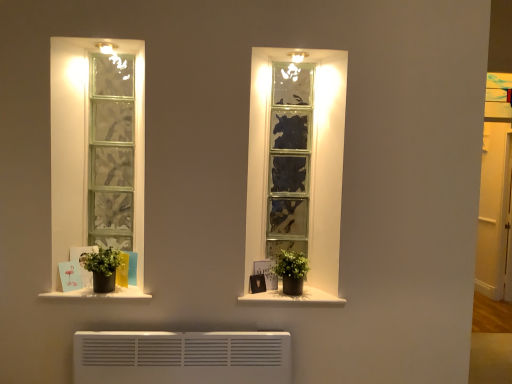
What is the approximate width of green matte pot at left, which is the first houseplant in left-to-right order?

green matte pot at left, which is the first houseplant in left-to-right order, is 6.57 inches wide.

What do you see at coordinates (495, 214) in the screenshot?
I see `transparent glass door at right` at bounding box center [495, 214].

What is the approximate width of white matte window sill at center, acting as the 2th window sill starting from the left?

white matte window sill at center, acting as the 2th window sill starting from the left, is 10.21 inches wide.

The width and height of the screenshot is (512, 384). What are the coordinates of `green matte plant at right, which is the first houseplant from right to left` in the screenshot? It's located at (291, 271).

Is green matte plant at right, which appears as the second houseplant when viewed from the left, with matte black picture frame at center?

green matte plant at right, which appears as the second houseplant when viewed from the left, and matte black picture frame at center are not in contact.

Would you say green matte plant at right, which is the first houseplant from right to left, is outside matte black picture frame at center?

Absolutely, green matte plant at right, which is the first houseplant from right to left, is external to matte black picture frame at center.

What's the angular difference between green matte plant at right, which is the first houseplant from right to left, and matte black picture frame at center's facing directions?

There is a 31.3-degree angle between the facing directions of green matte plant at right, which is the first houseplant from right to left, and matte black picture frame at center.

From a real-world perspective, which is physically above, green matte plant at right, which appears as the second houseplant when viewed from the left, or matte black picture frame at center?

green matte plant at right, which appears as the second houseplant when viewed from the left.

Measure the distance from transparent glass door at right to green matte plant at right, which appears as the second houseplant when viewed from the left.

A distance of 3.14 meters exists between transparent glass door at right and green matte plant at right, which appears as the second houseplant when viewed from the left.

Is transparent glass door at right beside green matte plant at right, which appears as the second houseplant when viewed from the left?

No, transparent glass door at right is not touching green matte plant at right, which appears as the second houseplant when viewed from the left.

Considering the positions of objects transparent glass door at right and green matte plant at right, which is the first houseplant from right to left, in the image provided, who is more to the right, transparent glass door at right or green matte plant at right, which is the first houseplant from right to left,?

Positioned to the right is transparent glass door at right.

Is transparent glass door at right in front of or behind green matte plant at right, which is the first houseplant from right to left, in the image?

In the image, transparent glass door at right appears behind green matte plant at right, which is the first houseplant from right to left.

Consider the image. Is white matte window sill at lower left, which ranks as the 2th window sill in right-to-left order, facing towards matte black picture frame at center?

No, white matte window sill at lower left, which ranks as the 2th window sill in right-to-left order, does not turn towards matte black picture frame at center.

This screenshot has width=512, height=384. Find the location of `picture frame above the white matte window sill at lower left, the 1th window sill in the left-to-right sequence (from a real-world perspective)`. picture frame above the white matte window sill at lower left, the 1th window sill in the left-to-right sequence (from a real-world perspective) is located at coordinates click(257, 283).

Is white matte window sill at lower left, which ranks as the 2th window sill in right-to-left order, spatially inside matte black picture frame at center, or outside of it?

white matte window sill at lower left, which ranks as the 2th window sill in right-to-left order, cannot be found inside matte black picture frame at center.

Is the position of white matte window sill at lower left, which ranks as the 2th window sill in right-to-left order, less distant than that of matte black picture frame at center?

Yes, white matte window sill at lower left, which ranks as the 2th window sill in right-to-left order, is closer to the camera.

Considering the sizes of objects white matte window sill at lower left, the 1th window sill in the left-to-right sequence, and white matte window sill at center, marked as the first window sill in a right-to-left arrangement, in the image provided, who is thinner, white matte window sill at lower left, the 1th window sill in the left-to-right sequence, or white matte window sill at center, marked as the first window sill in a right-to-left arrangement,?

With smaller width is white matte window sill at center, marked as the first window sill in a right-to-left arrangement.

Considering the relative sizes of white matte window sill at lower left, the 1th window sill in the left-to-right sequence, and white matte window sill at center, acting as the 2th window sill starting from the left, in the image provided, is white matte window sill at lower left, the 1th window sill in the left-to-right sequence, bigger than white matte window sill at center, acting as the 2th window sill starting from the left,?

Yes, white matte window sill at lower left, the 1th window sill in the left-to-right sequence, is bigger than white matte window sill at center, acting as the 2th window sill starting from the left.

Based on the photo, which is in front, white matte window sill at lower left, the 1th window sill in the left-to-right sequence, or white matte window sill at center, acting as the 2th window sill starting from the left?

Positioned in front is white matte window sill at lower left, the 1th window sill in the left-to-right sequence.

Considering the sizes of white matte window sill at lower left, which ranks as the 2th window sill in right-to-left order, and transparent glass door at right in the image, is white matte window sill at lower left, which ranks as the 2th window sill in right-to-left order, wider or thinner than transparent glass door at right?

Clearly, white matte window sill at lower left, which ranks as the 2th window sill in right-to-left order, has more width compared to transparent glass door at right.

From the image's perspective, is white matte window sill at lower left, which ranks as the 2th window sill in right-to-left order, on top of transparent glass door at right?

No, from the image's perspective, white matte window sill at lower left, which ranks as the 2th window sill in right-to-left order, is not over transparent glass door at right.

Does white matte window sill at lower left, the 1th window sill in the left-to-right sequence, touch transparent glass door at right?

No, white matte window sill at lower left, the 1th window sill in the left-to-right sequence, is not touching transparent glass door at right.

What's the angular difference between matte black picture frame at center and transparent glass door at right's facing directions?

The angle between the facing direction of matte black picture frame at center and the facing direction of transparent glass door at right is 29.9 degrees.

Is matte black picture frame at center in contact with transparent glass door at right?

matte black picture frame at center and transparent glass door at right are not in contact.

Which is nearer, [256,279] or [499,170]?

Point [256,279]

From the image's perspective, is matte black picture frame at center positioned above or below transparent glass door at right?

From the image's perspective, matte black picture frame at center appears below transparent glass door at right.

Does point (508, 182) lie in front of point (100, 291)?

No.

Considering the relative sizes of transparent glass door at right and green matte pot at left, which ranks as the 2th houseplant in right-to-left order, in the image provided, is transparent glass door at right bigger than green matte pot at left, which ranks as the 2th houseplant in right-to-left order,?

Correct, transparent glass door at right is larger in size than green matte pot at left, which ranks as the 2th houseplant in right-to-left order.

Can you confirm if transparent glass door at right is taller than green matte pot at left, which is the first houseplant in left-to-right order?

Correct, transparent glass door at right is much taller as green matte pot at left, which is the first houseplant in left-to-right order.

Find the location of `the 1st houseplant directly above the matte black picture frame at center (from a real-world perspective)`. the 1st houseplant directly above the matte black picture frame at center (from a real-world perspective) is located at coordinates (291, 271).

Identify the location of glass door behind the green matte plant at right, which is the first houseplant from right to left. click(495, 214).

Looking at this image, estimate the real-world distances between objects in this image. Which object is closer to white matte window sill at center, acting as the 2th window sill starting from the left, matte black picture frame at center or white matte window sill at lower left, the 1th window sill in the left-to-right sequence?

Among the two, matte black picture frame at center is located nearer to white matte window sill at center, acting as the 2th window sill starting from the left.

From the image, which object appears to be nearer to white matte window sill at lower left, which ranks as the 2th window sill in right-to-left order, green matte pot at left, which is the first houseplant in left-to-right order, or green matte plant at right, which is the first houseplant from right to left?

Based on the image, green matte pot at left, which is the first houseplant in left-to-right order, appears to be nearer to white matte window sill at lower left, which ranks as the 2th window sill in right-to-left order.

Considering their positions, is matte black picture frame at center positioned closer to white matte window sill at lower left, which ranks as the 2th window sill in right-to-left order, than green matte pot at left, which is the first houseplant in left-to-right order?

green matte pot at left, which is the first houseplant in left-to-right order, is closer to white matte window sill at lower left, which ranks as the 2th window sill in right-to-left order.

Estimate the real-world distances between objects in this image. Which object is closer to matte black picture frame at center, white matte window sill at lower left, the 1th window sill in the left-to-right sequence, or green matte pot at left, which is the first houseplant in left-to-right order?

white matte window sill at lower left, the 1th window sill in the left-to-right sequence.

From the image, which object appears to be farther from transparent glass door at right, white matte window sill at center, marked as the first window sill in a right-to-left arrangement, or matte black picture frame at center?

Among the two, matte black picture frame at center is located further to transparent glass door at right.

Estimate the real-world distances between objects in this image. Which object is further from transparent glass door at right, green matte plant at right, which appears as the second houseplant when viewed from the left, or white matte window sill at lower left, the 1th window sill in the left-to-right sequence?

white matte window sill at lower left, the 1th window sill in the left-to-right sequence, is further to transparent glass door at right.

From the image, which object appears to be nearer to white matte window sill at center, acting as the 2th window sill starting from the left, white matte window sill at lower left, which ranks as the 2th window sill in right-to-left order, or green matte plant at right, which is the first houseplant from right to left?

green matte plant at right, which is the first houseplant from right to left.

Considering their positions, is white matte window sill at lower left, which ranks as the 2th window sill in right-to-left order, positioned further to white matte window sill at center, marked as the first window sill in a right-to-left arrangement, than transparent glass door at right?

Among the two, transparent glass door at right is located further to white matte window sill at center, marked as the first window sill in a right-to-left arrangement.

The height and width of the screenshot is (384, 512). In order to click on window sill between white matte window sill at lower left, the 1th window sill in the left-to-right sequence, and transparent glass door at right, in the horizontal direction in this screenshot , I will do `click(294, 298)`.

Where is `houseplant between white matte window sill at center, acting as the 2th window sill starting from the left, and transparent glass door at right`? The width and height of the screenshot is (512, 384). houseplant between white matte window sill at center, acting as the 2th window sill starting from the left, and transparent glass door at right is located at coordinates (291, 271).

I want to click on picture frame between green matte pot at left, which is the first houseplant in left-to-right order, and green matte plant at right, which appears as the second houseplant when viewed from the left, in the horizontal direction, so click(257, 283).

Where is `picture frame between white matte window sill at lower left, the 1th window sill in the left-to-right sequence, and white matte window sill at center, marked as the first window sill in a right-to-left arrangement, in the horizontal direction`? Image resolution: width=512 pixels, height=384 pixels. picture frame between white matte window sill at lower left, the 1th window sill in the left-to-right sequence, and white matte window sill at center, marked as the first window sill in a right-to-left arrangement, in the horizontal direction is located at coordinates (257, 283).